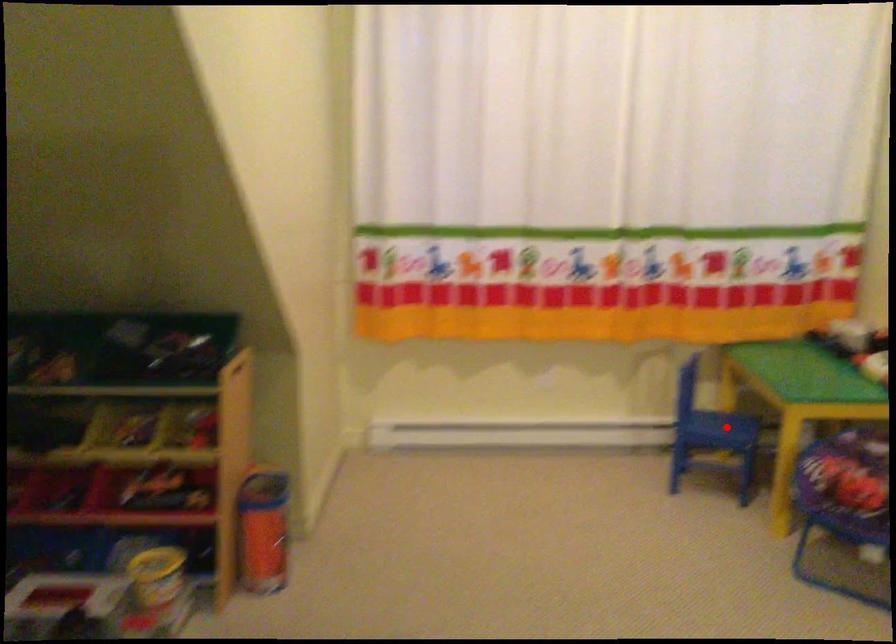
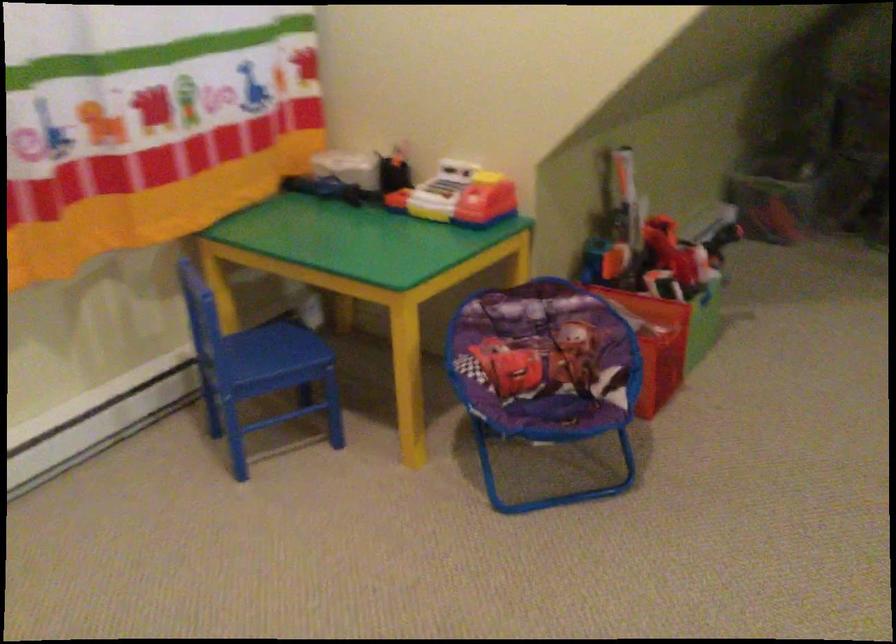
Find the pixel in the second image that matches the highlighted location in the first image.

(274, 348)